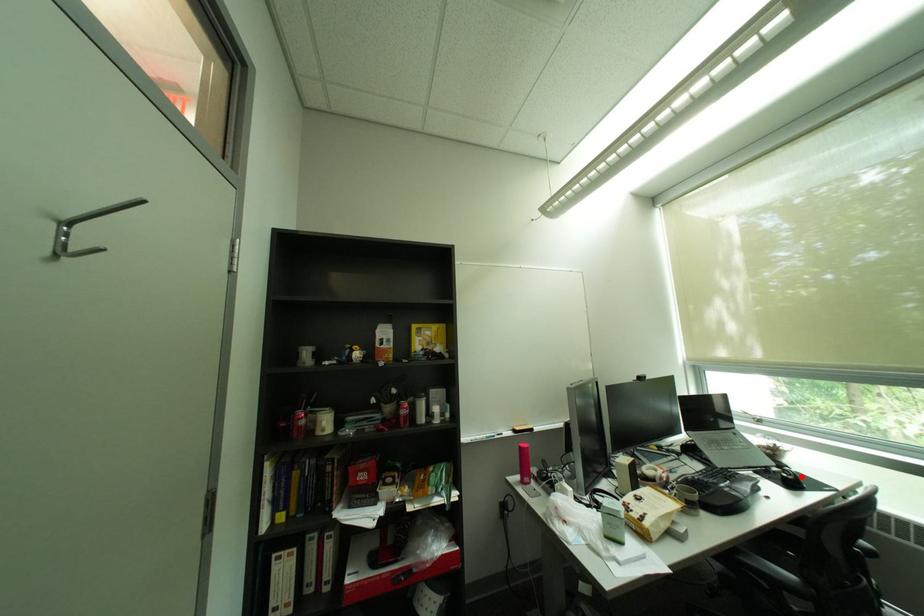
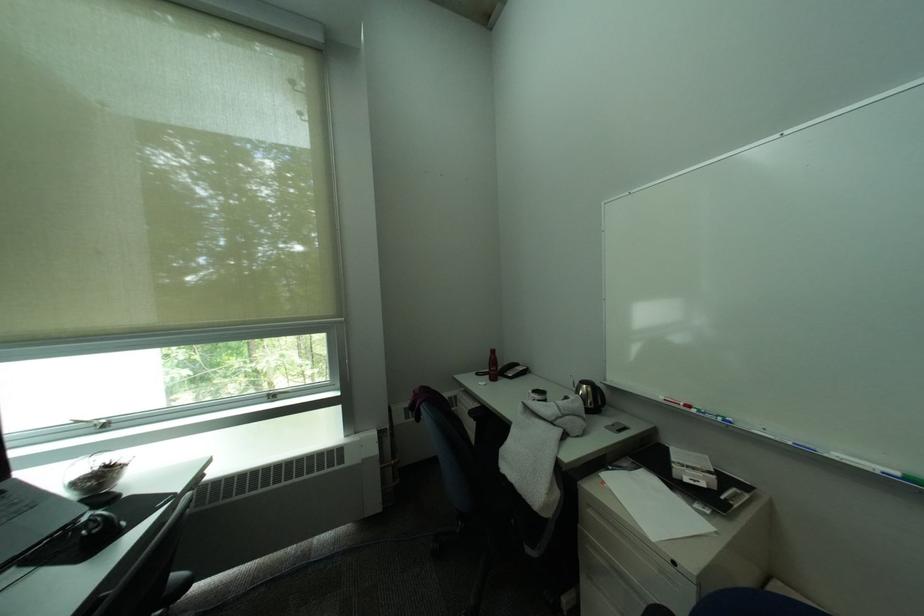
Question: I am providing you with two images of the same scene from different viewpoints. In image1, a red point is highlighted. Considering the same 3D point in image2, which of the following is correct?

Choices:
 (A) It is closer
 (B) It is farther

Answer: (A)